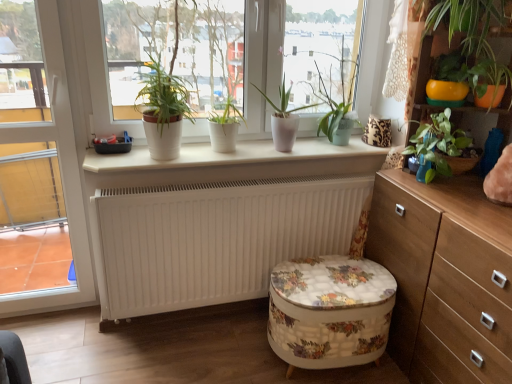
You are a GUI agent. You are given a task and a screenshot of the screen. Output one action in this format:
    pyautogui.click(x=<x>, y=<y>)
    Task: Click on the free spot below white glossy door at left (from a real-world perspective)
    The image size is (512, 384).
    Given the screenshot: What is the action you would take?
    pyautogui.click(x=53, y=316)